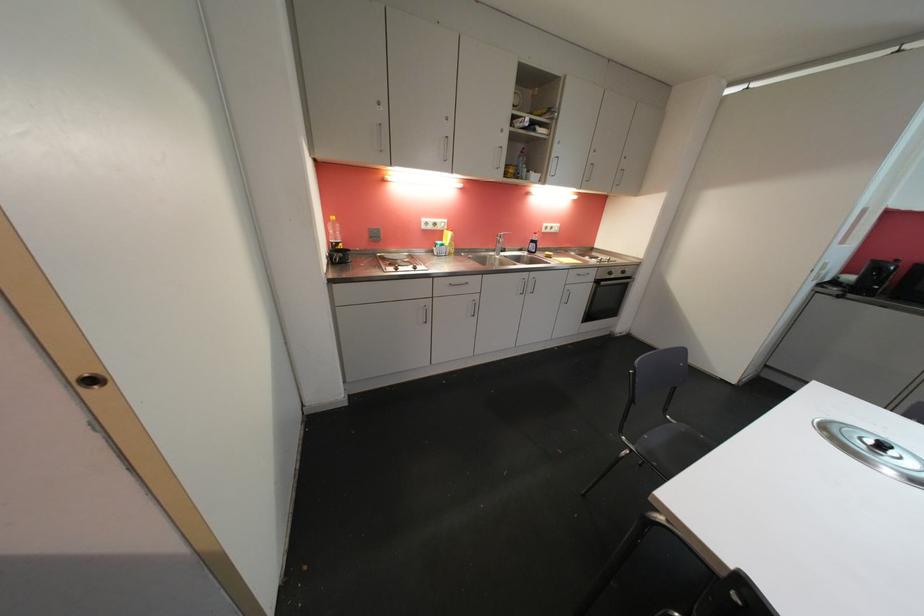
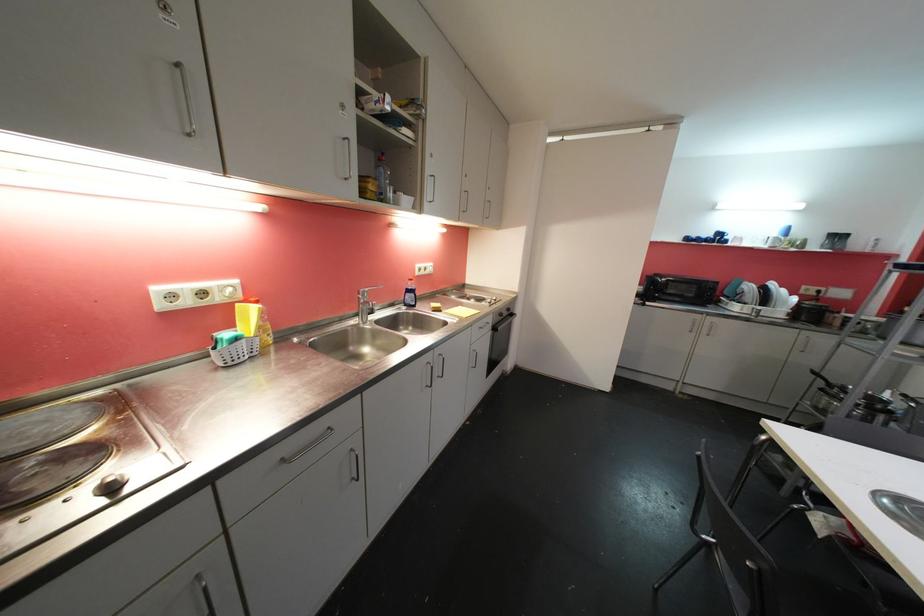
Find the pixel in the second image that matches (x=614, y=276) in the first image.

(505, 317)